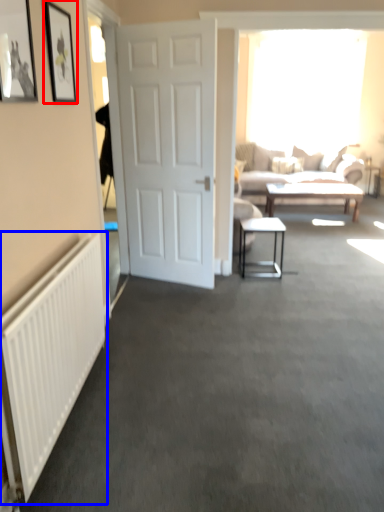
Question: Which object appears farthest to the camera in this image, picture frame (highlighted by a red box) or radiator (highlighted by a blue box)?

Choices:
 (A) picture frame
 (B) radiator

Answer: (A)